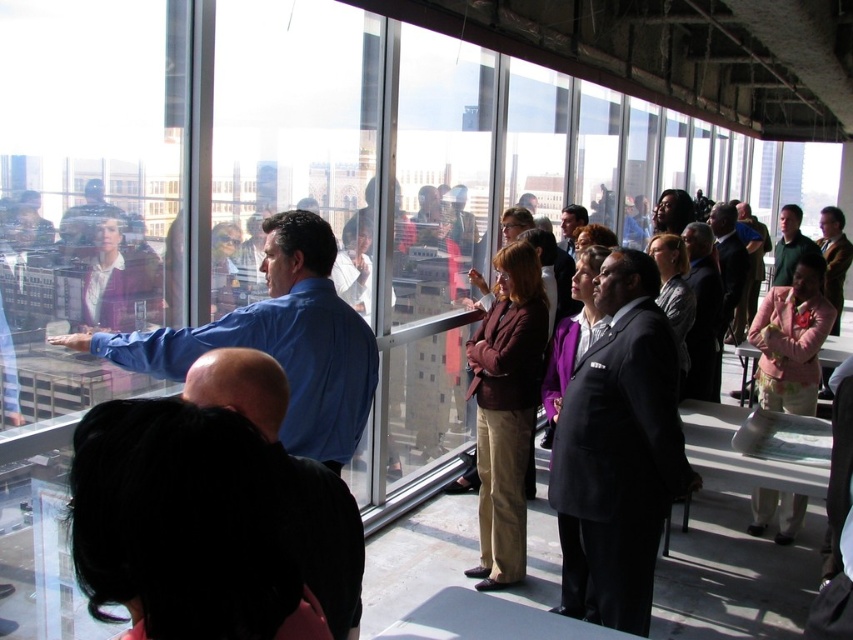
Can you confirm if matte blue shirt at upper center is taller than dark green shirt at right?

No.

Who is more distant from viewer, [91,180] or [793,241]?

Point [793,241]

Is point (85, 184) positioned before point (808, 248)?

Yes, point (85, 184) is in front of point (808, 248).

The width and height of the screenshot is (853, 640). In order to click on matte blue shirt at upper center in this screenshot , I will do `click(88, 216)`.

Is point (642, 444) positioned behind point (338, 515)?

Yes.

Identify the location of dark suit at center. (618, 451).

Can you confirm if blue shirt at center is positioned below matte black suit at center?

Yes, blue shirt at center is below matte black suit at center.

Is point (276, 348) positioned before point (569, 228)?

Yes, point (276, 348) is in front of point (569, 228).

This screenshot has width=853, height=640. What are the coordinates of `blue shirt at center` in the screenshot? It's located at (277, 340).